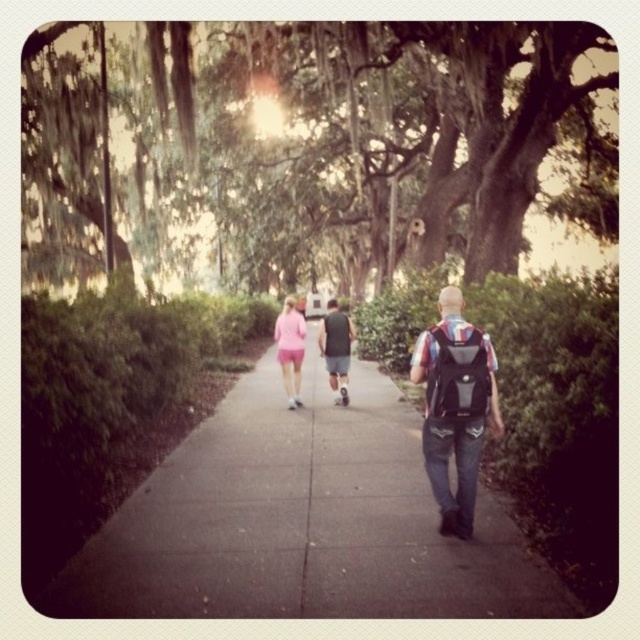
Which is below, concrete at center or black matte backpack at center?

concrete at center is below.

Can you confirm if concrete at center is wider than black matte backpack at center?

No.

You are a GUI agent. You are given a task and a screenshot of the screen. Output one action in this format:
    pyautogui.click(x=<x>, y=<y>)
    Task: Click on the concrete at center
    The image size is (640, 640).
    Given the screenshot: What is the action you would take?
    pyautogui.click(x=301, y=522)

In order to click on concrete at center in this screenshot , I will do `click(301, 522)`.

The width and height of the screenshot is (640, 640). I want to click on green mossy tree at upper center, so click(x=372, y=138).

Which is above, green mossy tree at upper center or dark gray fabric shirt at center?

green mossy tree at upper center is higher up.

Image resolution: width=640 pixels, height=640 pixels. What do you see at coordinates (372, 138) in the screenshot? I see `green mossy tree at upper center` at bounding box center [372, 138].

Where is `green mossy tree at upper center`? Image resolution: width=640 pixels, height=640 pixels. green mossy tree at upper center is located at coordinates (372, 138).

Does green mossy tree at upper center have a lesser width compared to black matte backpack at center?

No.

Who is more distant from viewer, (362, 276) or (472, 349)?

The point (362, 276) is behind.

This screenshot has width=640, height=640. I want to click on green mossy tree at upper center, so click(372, 138).